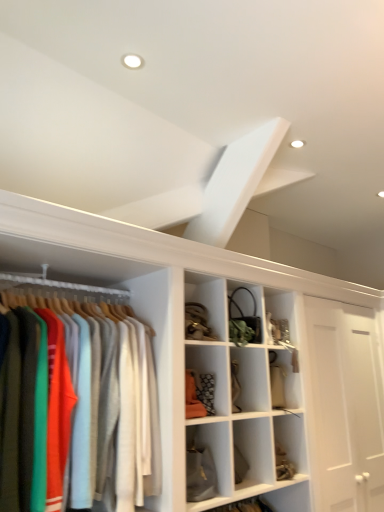
Question: Would you say white matte exhaust hood at upper center is inside or outside matte cotton shirts at left?

Choices:
 (A) inside
 (B) outside

Answer: (B)

Question: Is point (226, 198) closer or farther from the camera than point (44, 409)?

Choices:
 (A) closer
 (B) farther

Answer: (B)

Question: From a real-world perspective, relative to matte cotton shirts at left, is white matte exhaust hood at upper center vertically above or below?

Choices:
 (A) above
 (B) below

Answer: (A)

Question: From a real-world perspective, is matte cotton shirts at left physically located above or below white matte exhaust hood at upper center?

Choices:
 (A) below
 (B) above

Answer: (A)

Question: Considering the relative positions of matte cotton shirts at left and white matte exhaust hood at upper center in the image provided, is matte cotton shirts at left to the left or to the right of white matte exhaust hood at upper center?

Choices:
 (A) right
 (B) left

Answer: (B)

Question: Considering the positions of point [x=148, y=391] and point [x=193, y=227], is point [x=148, y=391] closer or farther from the camera than point [x=193, y=227]?

Choices:
 (A) closer
 (B) farther

Answer: (A)

Question: In terms of width, does matte cotton shirts at left look wider or thinner when compared to white matte exhaust hood at upper center?

Choices:
 (A) wide
 (B) thin

Answer: (A)